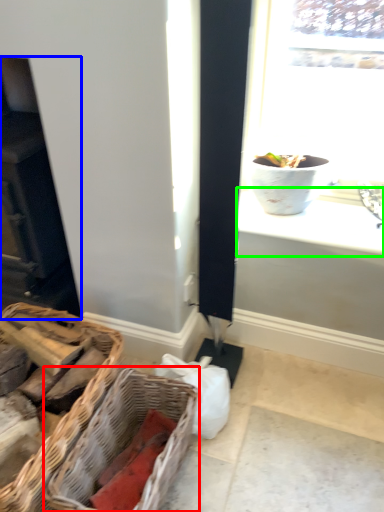
Question: Considering the real-world distances, which object is farthest from picnic basket (highlighted by a red box)? fireplace (highlighted by a blue box) or window sill (highlighted by a green box)?

Choices:
 (A) fireplace
 (B) window sill

Answer: (A)